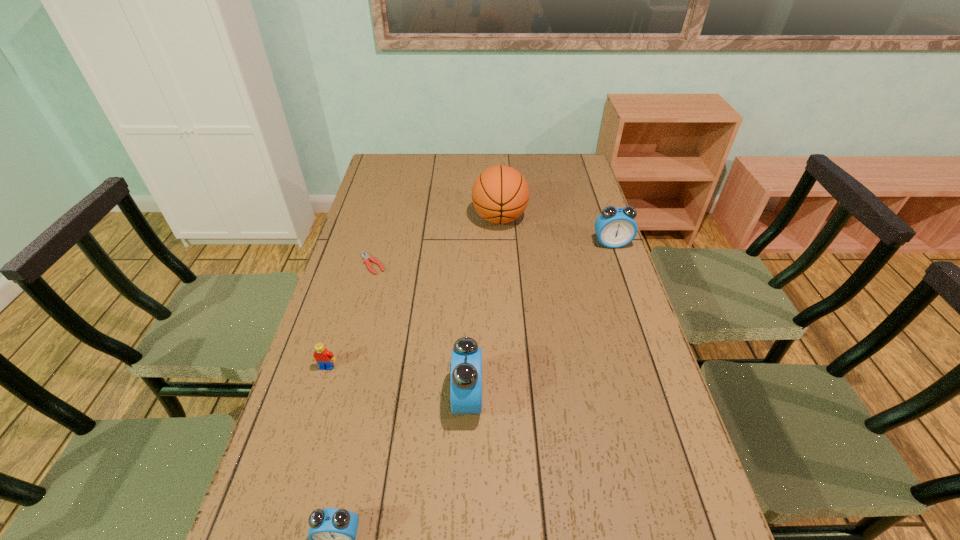
Please point a location where one more alarm_clock can be added evenly. Please provide its 2D coordinates. Your answer should be formatted as a tuple, i.e. [(x, y)], where the tuple contains the x and y coordinates of a point satisfying the conditions above.

[(552, 308)]